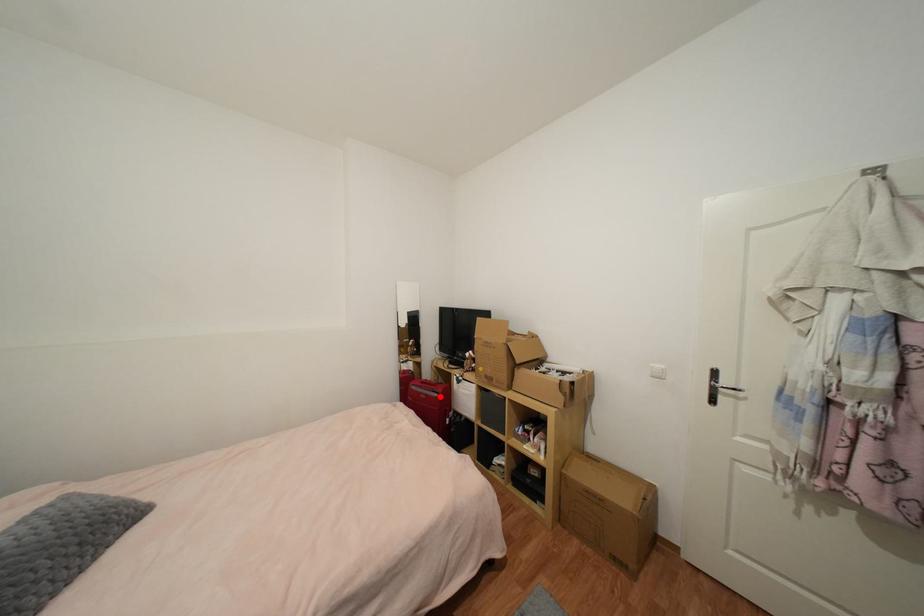
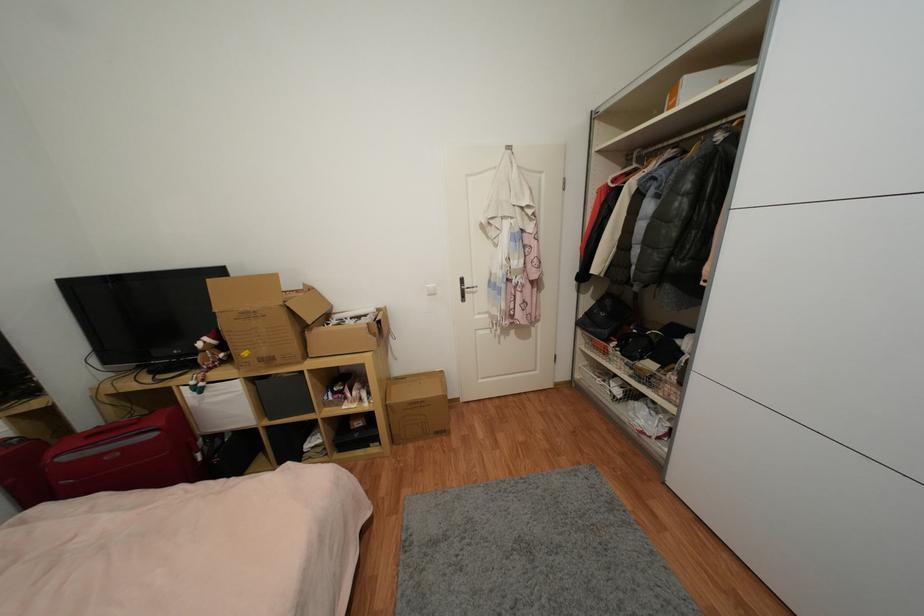
Where in the second image is the point corresponding to the highlighted location from the first image?

(157, 436)